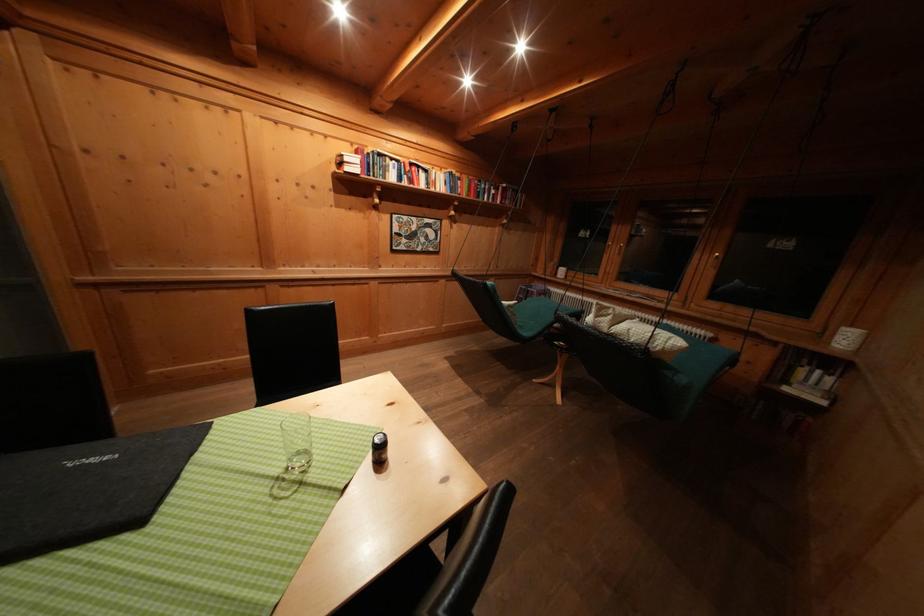
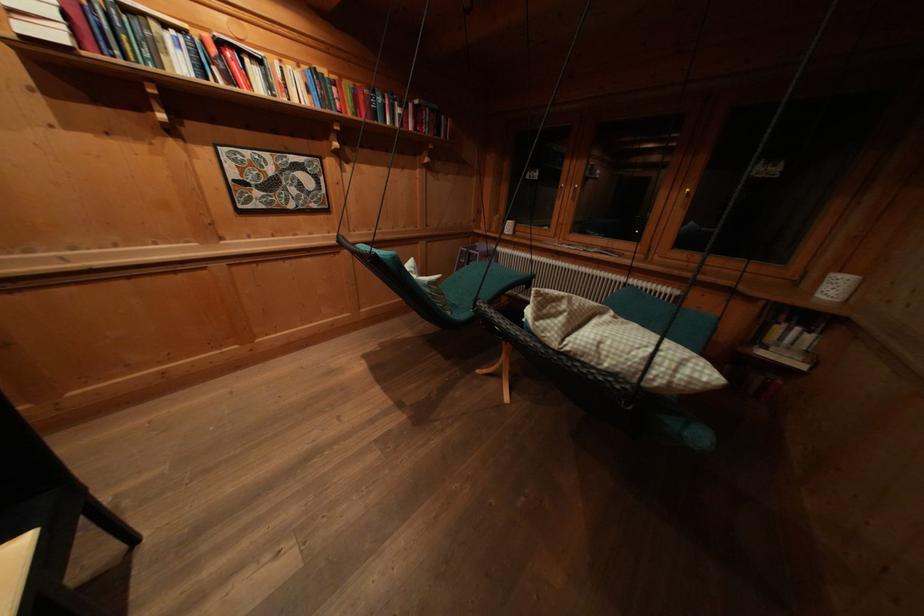
Find the pixel in the second image that matches (x=850, y=347) in the first image.

(839, 298)